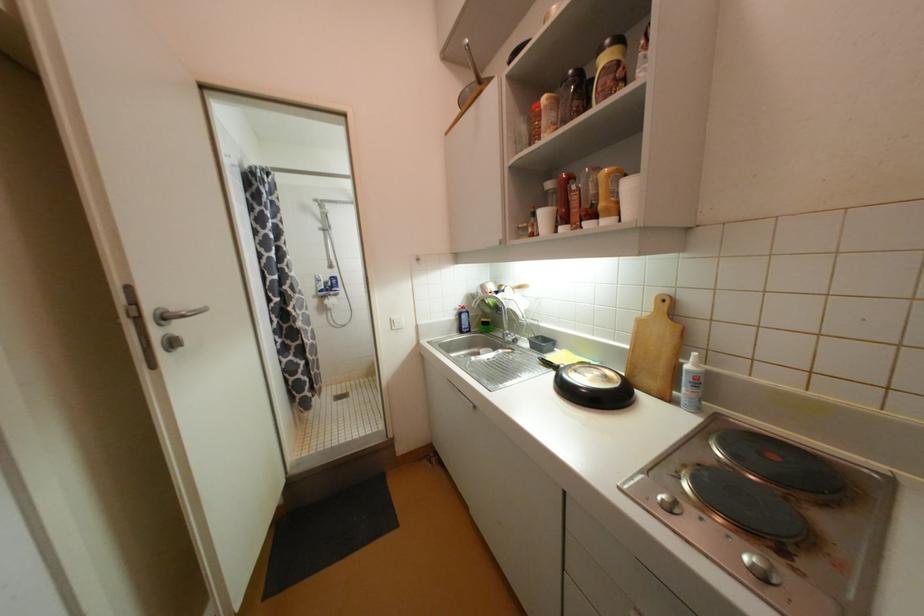
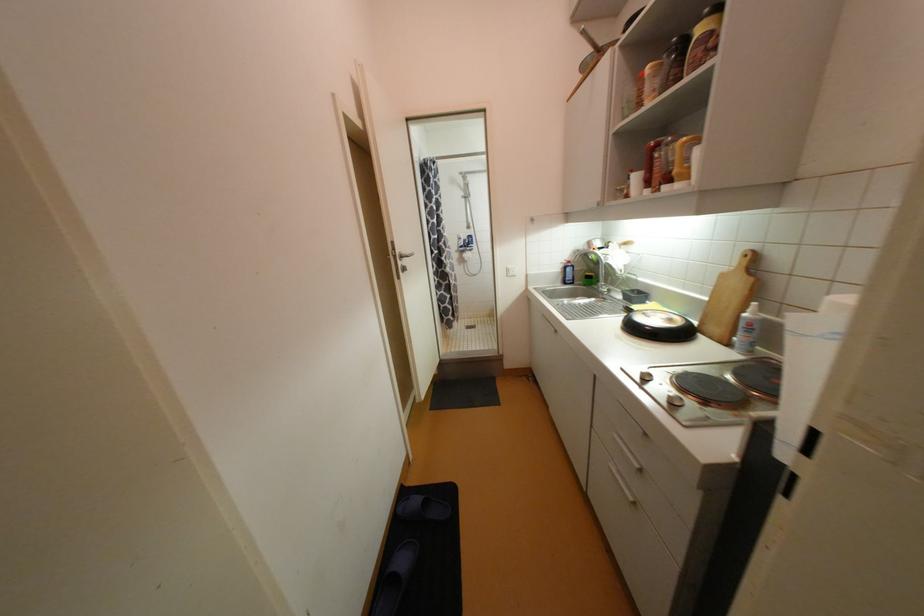
Question: The camera is either moving clockwise (left) or counter-clockwise (right) around the object. The first image is from the beginning of the video and the second image is from the end. Is the camera moving left or right when shooting the video?

Choices:
 (A) Left
 (B) Right

Answer: (B)